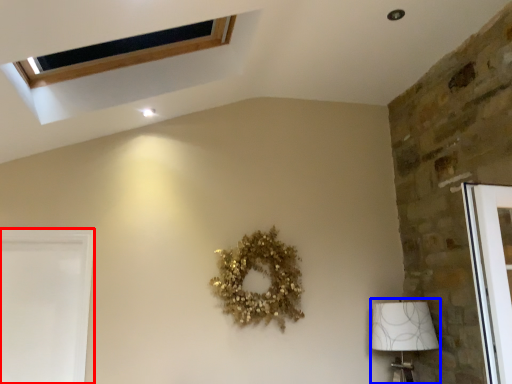
Question: Which of the following is the closest to the observer, screen door (highlighted by a red box) or lamp (highlighted by a blue box)?

Choices:
 (A) screen door
 (B) lamp

Answer: (A)